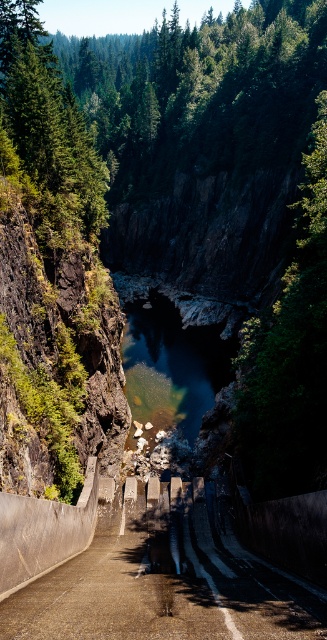
Between concrete steps at center and clear blue water at center, which one appears on the right side from the viewer's perspective?

Positioned to the right is clear blue water at center.

Can you confirm if concrete steps at center is bigger than clear blue water at center?

No, concrete steps at center is not bigger than clear blue water at center.

Between point (312, 621) and point (201, 401), which one is positioned behind?

The point (201, 401) is behind.

Locate an element on the screen. concrete steps at center is located at coordinates (166, 580).